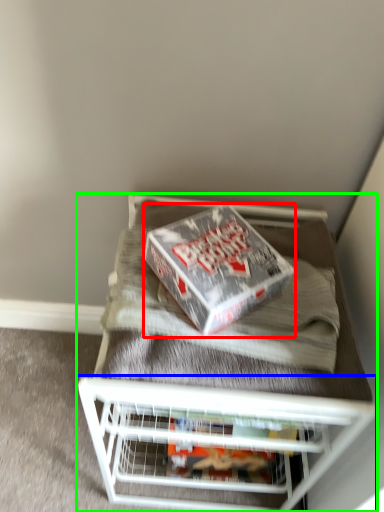
Question: Considering the real-world distances, which object is closest to box (highlighted by a red box)? shelf (highlighted by a blue box) or furniture (highlighted by a green box).

Choices:
 (A) shelf
 (B) furniture

Answer: (B)